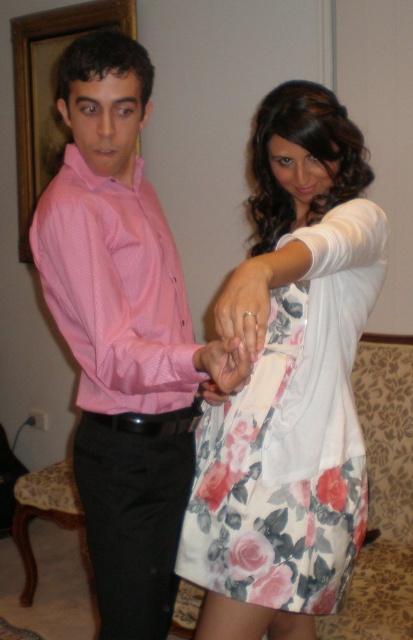
Which is below, pink smooth shirt at center or black leather belt at lower center?

Positioned lower is black leather belt at lower center.

Who is more distant from viewer, (80, 470) or (121, 424)?

The point (80, 470) is behind.

Which is in front, point (137, 268) or point (97, 419)?

Point (137, 268) is more forward.

You are a GUI agent. You are given a task and a screenshot of the screen. Output one action in this format:
    pyautogui.click(x=<x>, y=<y>)
    Task: Click on the pink smooth shirt at center
    The height and width of the screenshot is (640, 413).
    Given the screenshot: What is the action you would take?
    pyautogui.click(x=113, y=241)

Who is positioned more to the left, pink smooth shirt at center or pink shirt at left?

Positioned to the left is pink shirt at left.

Describe the element at coordinates (113, 241) in the screenshot. I see `pink smooth shirt at center` at that location.

What are the coordinates of `pink smooth shirt at center` in the screenshot? It's located at (113, 241).

Between floral cotton dress at center and matte white ring at center, which one is positioned higher?

matte white ring at center is higher up.

Who is positioned more to the left, floral cotton dress at center or matte white ring at center?

matte white ring at center is more to the left.

Does point (349, 260) lie in front of point (253, 321)?

No.

This screenshot has height=640, width=413. What are the coordinates of `floral cotton dress at center` in the screenshot? It's located at (291, 436).